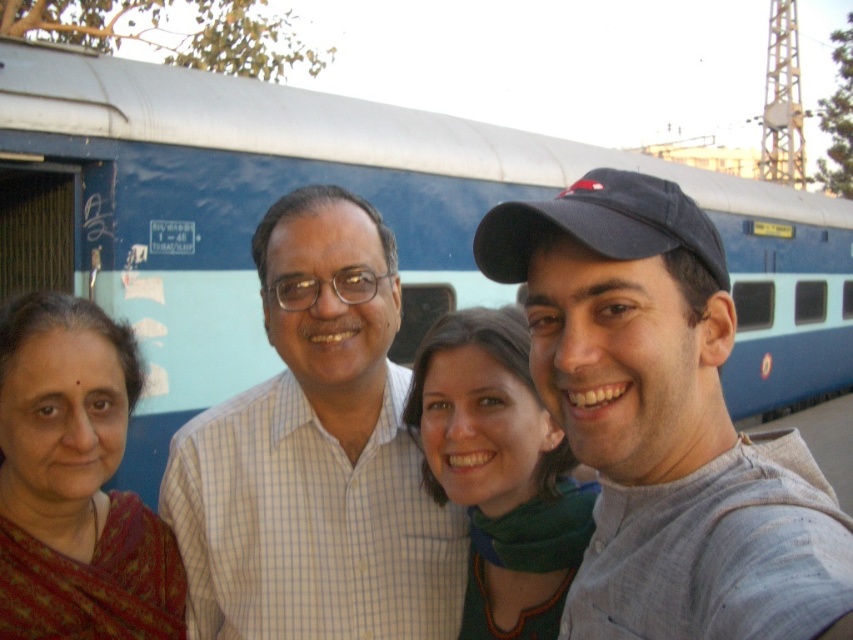
Question: Among these points, which one is farthest from the camera?

Choices:
 (A) (59, 74)
 (B) (148, 557)
 (C) (440, 515)
 (D) (480, 252)

Answer: (A)

Question: Can you confirm if reddish-brown sari at left is positioned to the right of green fabric scarf at center?

Choices:
 (A) no
 (B) yes

Answer: (A)

Question: Can you confirm if white checkered shirt at center is positioned below reddish-brown sari at left?

Choices:
 (A) yes
 (B) no

Answer: (B)

Question: Considering the real-world distances, which object is closest to the gray cotton cap at upper right?

Choices:
 (A) green fabric scarf at center
 (B) reddish-brown sari at left

Answer: (A)

Question: Which of the following is the farthest from the observer?

Choices:
 (A) gray cotton cap at upper right
 (B) blue painted train at center
 (C) reddish-brown sari at left
 (D) white checkered shirt at center

Answer: (B)

Question: Can you confirm if blue painted train at center is wider than white checkered shirt at center?

Choices:
 (A) yes
 (B) no

Answer: (A)